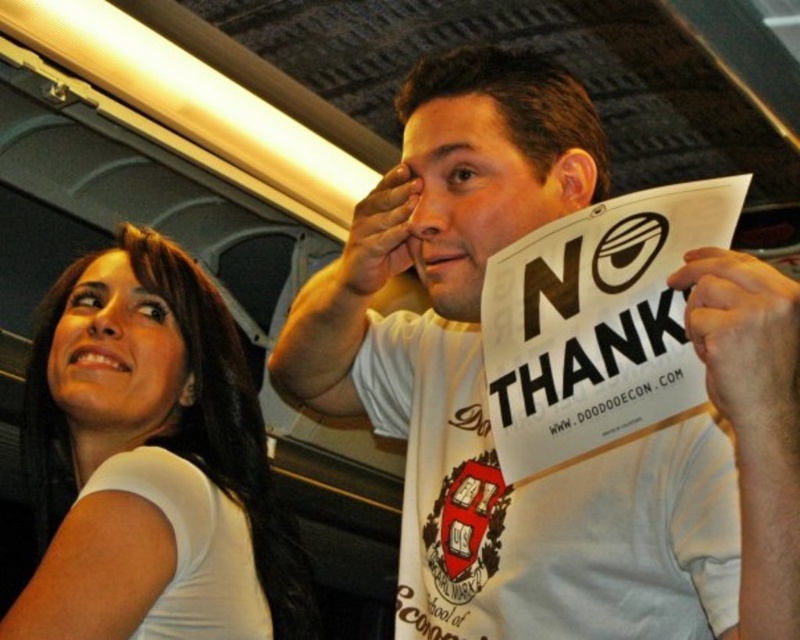
You are standing in front of the image and want to determine which of the two points, point (x=594, y=516) or point (x=117, y=435), is closer to you. Based on the scene, which point is nearer?

Point (x=594, y=516) is closer to the viewer than point (x=117, y=435).